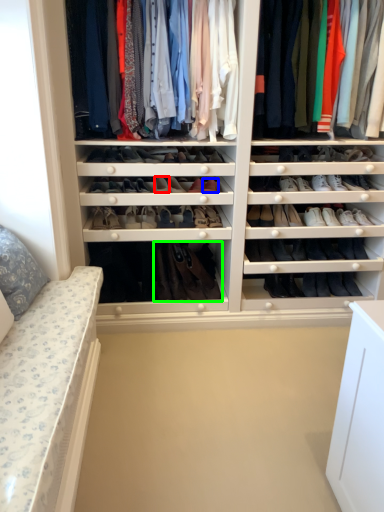
Question: Which object is positioned farthest from shoe (highlighted by a red box)? Select from shoe (highlighted by a blue box) and footwear (highlighted by a green box).

Choices:
 (A) shoe
 (B) footwear

Answer: (B)